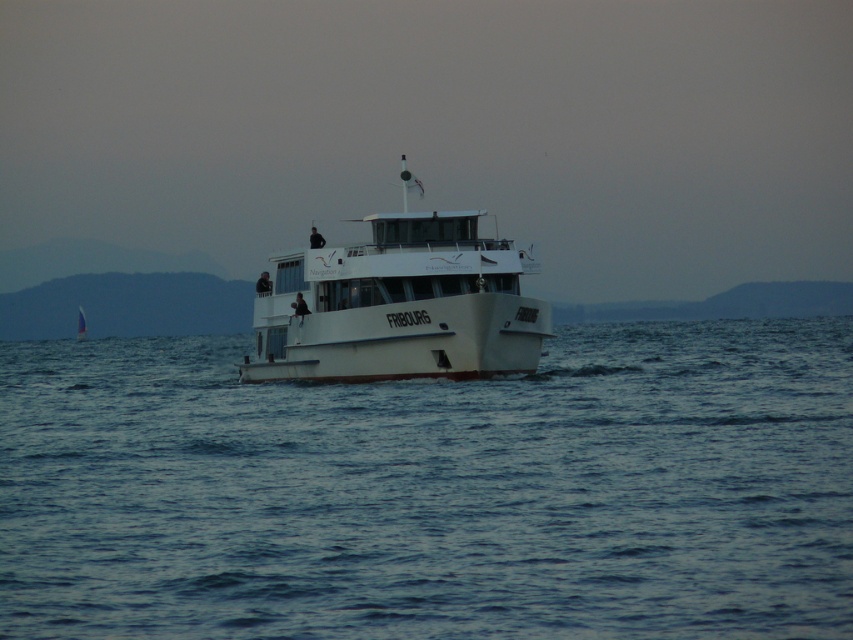
Question: Can you confirm if blue water at center is positioned to the right of white matte boat at center?

Choices:
 (A) no
 (B) yes

Answer: (B)

Question: Can you confirm if blue water at center is positioned to the left of white matte boat at center?

Choices:
 (A) no
 (B) yes

Answer: (A)

Question: Is blue water at center behind white matte boat at center?

Choices:
 (A) no
 (B) yes

Answer: (A)